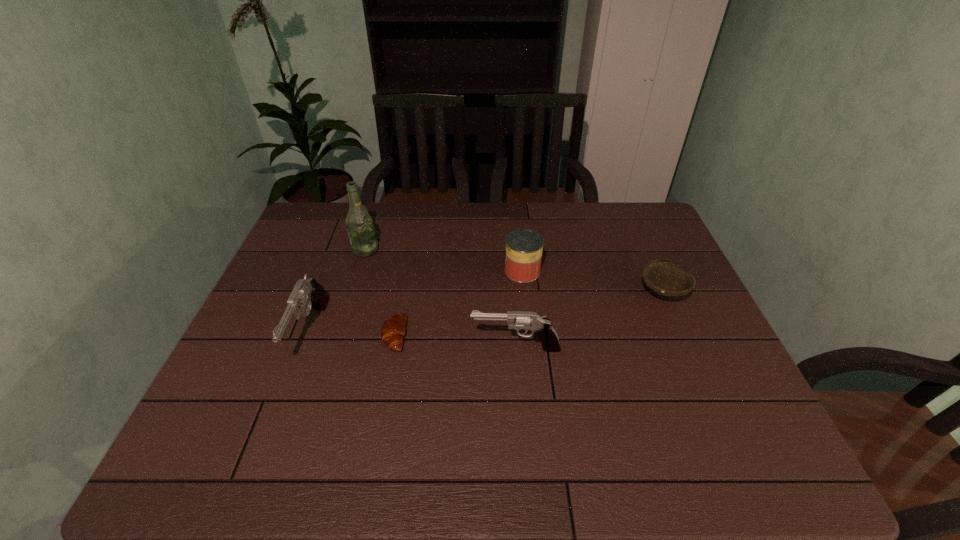
Locate an element on the screen. This screenshot has height=540, width=960. free space between the taller gun and the shorter gun is located at coordinates (413, 341).

Identify the location of free point between the leftmost object and the right gun. (413, 341).

Identify the location of vacant area that lies between the can and the leftmost object. (417, 303).

This screenshot has width=960, height=540. In order to click on vacant area between the shorter gun and the can in this screenshot , I will do [x=519, y=309].

Find the location of a particular element. Image resolution: width=960 pixels, height=540 pixels. blank region between the shorter gun and the can is located at coordinates (519, 309).

This screenshot has height=540, width=960. Identify the location of object that is the fifth closest to the shorter gun. (359, 224).

At what (x,y) coordinates should I click in order to perform the action: click on object that is the fourth closest to the shorter gun. Please return your answer as a coordinate pair (x, y). This screenshot has height=540, width=960. Looking at the image, I should click on (308, 291).

At what (x,y) coordinates should I click in order to perform the action: click on vacant region that satisfies the following two spatial constraints: 1. on the back side of the can; 2. on the right side of the third object from left to right. Please return your answer as a coordinate pair (x, y). Image resolution: width=960 pixels, height=540 pixels. Looking at the image, I should click on (406, 271).

Image resolution: width=960 pixels, height=540 pixels. I want to click on free point that satisfies the following two spatial constraints: 1. on the surface of the tallest object; 2. on the back side of the shortest object, so click(339, 335).

Where is `vacant area that satisfies the following two spatial constraints: 1. on the surface of the tallest object; 2. on the right side of the can`? vacant area that satisfies the following two spatial constraints: 1. on the surface of the tallest object; 2. on the right side of the can is located at coordinates (359, 271).